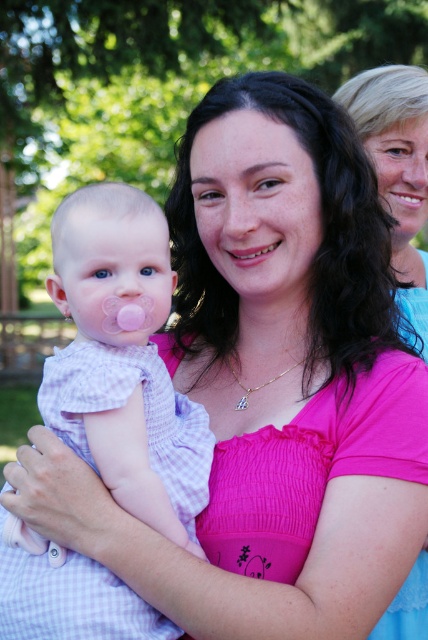
Looking at the scene, which object has a larger size between the smooth skin mouth at upper right and the smooth skin at center?

The smooth skin mouth at upper right is bigger than smooth skin at center.

You are standing in the scene and notice the point at coordinates (124, 362). What object is located at this point?

The point at coordinates (124, 362) indicates the pink checkered fabric at left.

You are an observer looking at the scene. You see the pink checkered fabric at left and the pink fabric shirt at center. Which one is shorter in height?

The pink checkered fabric at left is shorter in height than the pink fabric shirt at center because it is not as tall as the pink fabric shirt at center.